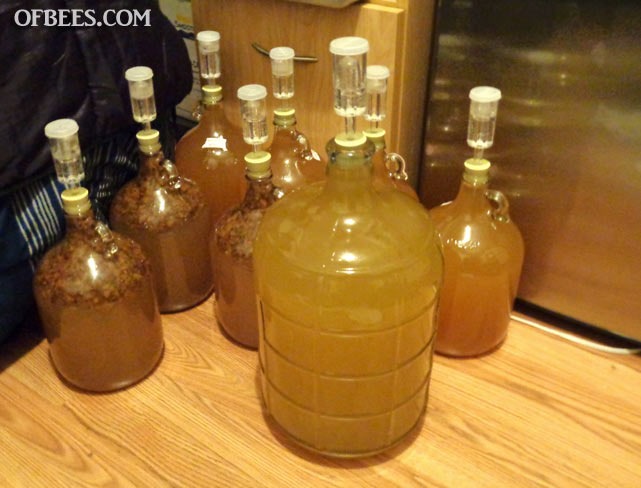
Identify the location of bottle. The width and height of the screenshot is (641, 488). (212, 175).